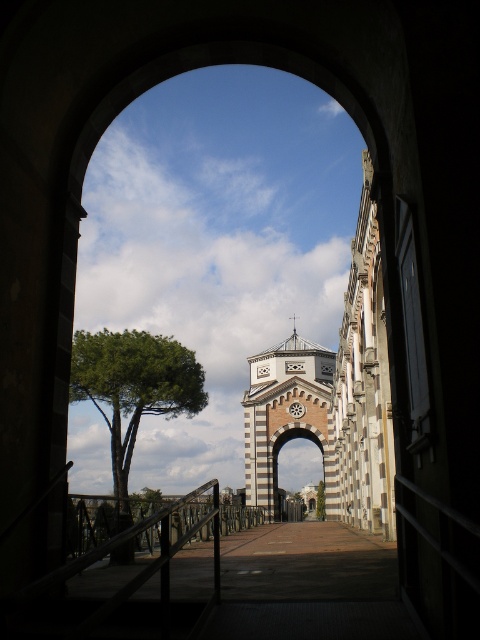
Question: Does green leafy tree at left lie behind matte brick archway at center?

Choices:
 (A) yes
 (B) no

Answer: (B)

Question: Which point is closer to the camera?

Choices:
 (A) green leafy tree at center
 (B) matte brick archway at center

Answer: (B)

Question: Does green leafy tree at left appear on the right side of green leafy tree at center?

Choices:
 (A) yes
 (B) no

Answer: (B)

Question: Which point appears closest to the camera in this image?

Choices:
 (A) (280, 444)
 (B) (321, 500)
 (C) (199, 385)

Answer: (C)

Question: Which is farther from the green leafy tree at left?

Choices:
 (A) matte brick archway at center
 (B) green leafy tree at center

Answer: (B)

Question: Where is matte brick archway at center located in relation to green leafy tree at center in the image?

Choices:
 (A) above
 (B) below

Answer: (A)